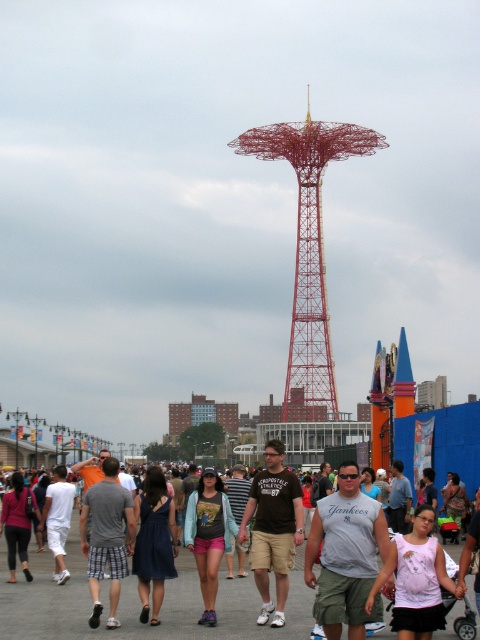
Question: Which object appears closest to the camera in this image?

Choices:
 (A) brown cotton t-shirt at center
 (B) pink cotton tank top at center
 (C) gray cotton tank top at center

Answer: (B)

Question: Does matte black tank top at center have a greater width compared to red metal structure at center?

Choices:
 (A) yes
 (B) no

Answer: (A)

Question: Where is brown cotton t-shirt at center located in relation to pink cotton tank top at center in the image?

Choices:
 (A) below
 (B) above

Answer: (B)

Question: Which point is farther to the camera?

Choices:
 (A) (348, 509)
 (B) (106, 460)
 (C) (32, 605)
 (D) (330, 392)

Answer: (D)

Question: Among these objects, which one is nearest to the camera?

Choices:
 (A) matte black tank top at center
 (B) pink cotton tank top at center

Answer: (B)

Question: Does matte black tank top at center appear under brown cotton t-shirt at center?

Choices:
 (A) yes
 (B) no

Answer: (A)